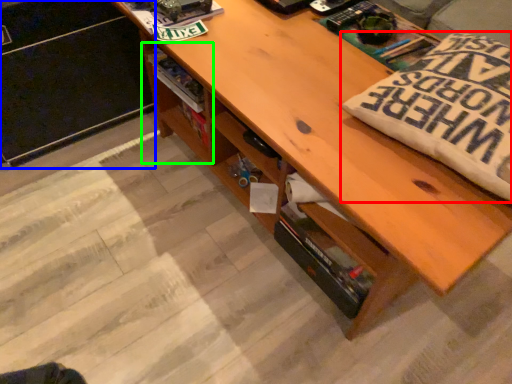
Question: Which object is the closest to the throw pillow (highlighted by a red box)? Choose among these: file cabinet (highlighted by a blue box) or shelf (highlighted by a green box).

Choices:
 (A) file cabinet
 (B) shelf

Answer: (B)